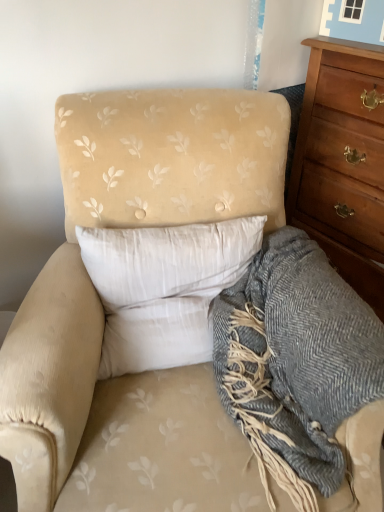
Question: Does wooden chest of drawers at right appear on the left side of gray woolen blanket at lower right?

Choices:
 (A) yes
 (B) no

Answer: (B)

Question: From a real-world perspective, is wooden chest of drawers at right positioned under gray woolen blanket at lower right based on gravity?

Choices:
 (A) yes
 (B) no

Answer: (B)

Question: Does wooden chest of drawers at right turn towards gray woolen blanket at lower right?

Choices:
 (A) no
 (B) yes

Answer: (B)

Question: Considering the relative sizes of wooden chest of drawers at right and gray woolen blanket at lower right in the image provided, is wooden chest of drawers at right smaller than gray woolen blanket at lower right?

Choices:
 (A) yes
 (B) no

Answer: (B)

Question: Does wooden chest of drawers at right have a lesser width compared to gray woolen blanket at lower right?

Choices:
 (A) no
 (B) yes

Answer: (B)

Question: From the image's perspective, is wooden chest of drawers at right positioned above or below white soft pillow at center?

Choices:
 (A) below
 (B) above

Answer: (B)

Question: Considering the positions of wooden chest of drawers at right and white soft pillow at center in the image, is wooden chest of drawers at right taller or shorter than white soft pillow at center?

Choices:
 (A) tall
 (B) short

Answer: (A)

Question: Based on their sizes in the image, would you say wooden chest of drawers at right is bigger or smaller than white soft pillow at center?

Choices:
 (A) small
 (B) big

Answer: (B)

Question: Considering the positions of wooden chest of drawers at right and white soft pillow at center in the image, is wooden chest of drawers at right wider or thinner than white soft pillow at center?

Choices:
 (A) thin
 (B) wide

Answer: (B)

Question: Is point (109, 249) closer or farther from the camera than point (344, 98)?

Choices:
 (A) closer
 (B) farther

Answer: (A)

Question: From a real-world perspective, is white soft pillow at center positioned above or below wooden chest of drawers at right?

Choices:
 (A) above
 (B) below

Answer: (A)

Question: Would you say white soft pillow at center is to the left or to the right of wooden chest of drawers at right in the picture?

Choices:
 (A) right
 (B) left

Answer: (B)

Question: From their relative heights in the image, would you say white soft pillow at center is taller or shorter than wooden chest of drawers at right?

Choices:
 (A) tall
 (B) short

Answer: (B)

Question: In terms of size, does white soft pillow at center appear bigger or smaller than gray woolen blanket at lower right?

Choices:
 (A) big
 (B) small

Answer: (B)

Question: Considering the positions of white soft pillow at center and gray woolen blanket at lower right in the image, is white soft pillow at center wider or thinner than gray woolen blanket at lower right?

Choices:
 (A) thin
 (B) wide

Answer: (A)